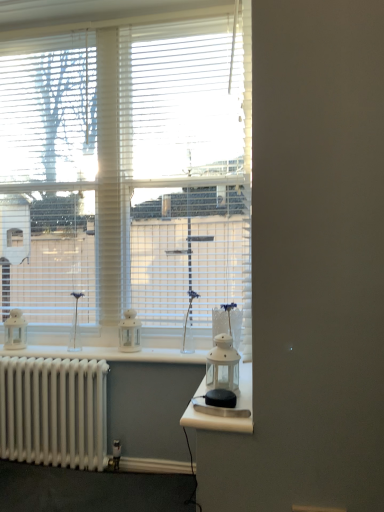
Question: Considering the positions of white plastic blinds at upper left and white blinds at upper center, which ranks as the 1th window in left-to-right order, in the image, is white plastic blinds at upper left bigger or smaller than white blinds at upper center, which ranks as the 1th window in left-to-right order,?

Choices:
 (A) big
 (B) small

Answer: (B)

Question: Considering the relative positions of white plastic blinds at upper left and white blinds at upper center, which ranks as the 1th window in left-to-right order, in the image provided, is white plastic blinds at upper left to the left or to the right of white blinds at upper center, which ranks as the 1th window in left-to-right order,?

Choices:
 (A) right
 (B) left

Answer: (B)

Question: Which object is positioned farthest from the white plastic blinds at upper left?

Choices:
 (A) white glass lantern at center
 (B) white matte window at center, placed as the second window when sorted from left to right
 (C) white metallic radiator at lower left
 (D) white matte lantern at center, which is the first appliance in left-to-right order
 (E) white blinds at upper center, which ranks as the 1th window in left-to-right order

Answer: (A)

Question: Which is farther from the white matte lantern at center, the second appliance in the front-to-back sequence?

Choices:
 (A) white glass lantern at center, the 1th appliance when ordered from front to back
 (B) white plastic blinds at upper left
 (C) white matte window at center, the first window positioned from the right
 (D) white glass lantern at center
 (E) white blinds at upper center, marked as the second window in a right-to-left arrangement

Answer: (D)